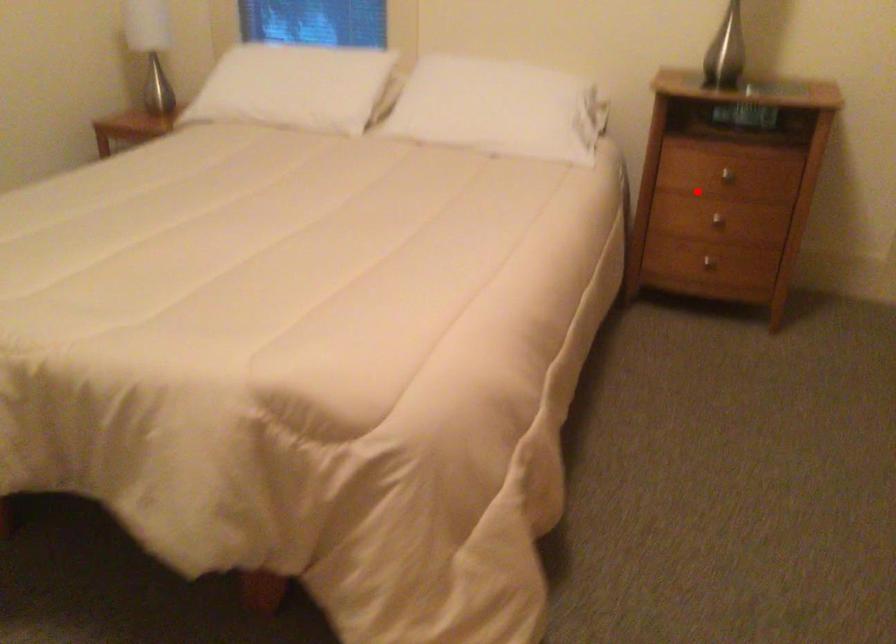
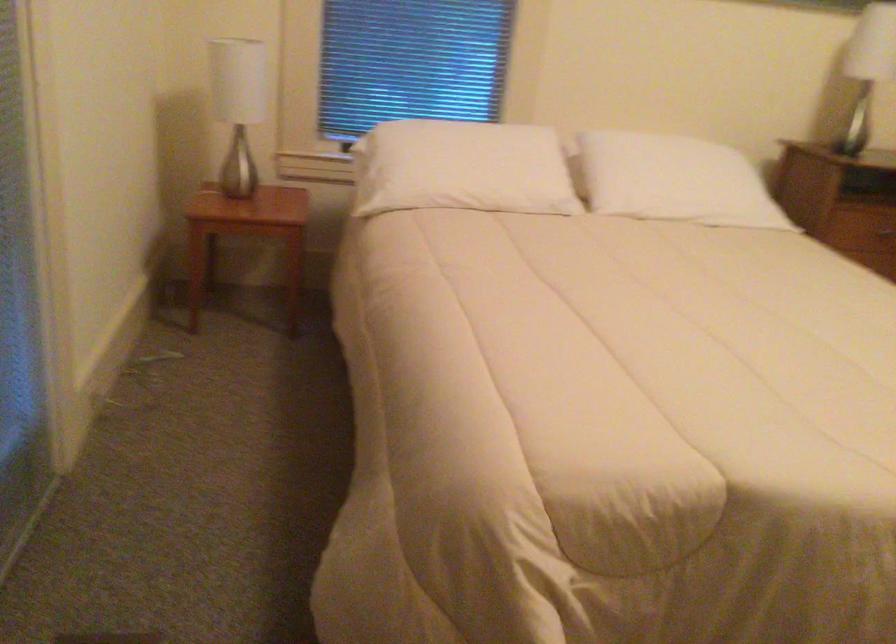
Question: I am providing you with two images of the same scene from different viewpoints. Given a red point in image1, look at the same physical point in image2. Is it:

Choices:
 (A) Closer to the viewpoint
 (B) Farther from the viewpoint

Answer: (B)